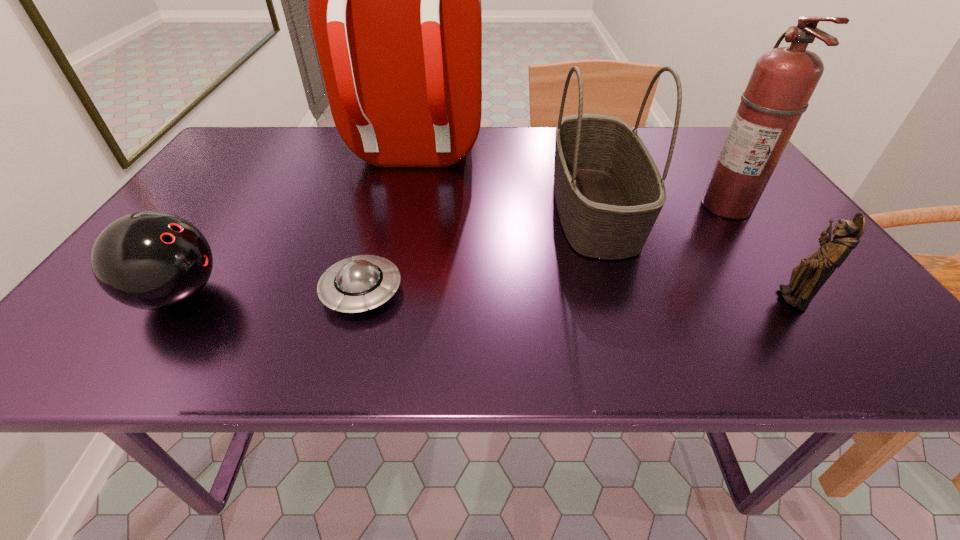
Locate an element on the screen. object that is the fourth closest to the tallest object is located at coordinates (783, 80).

The image size is (960, 540). What are the coordinates of `vacant region that satisfies the following two spatial constraints: 1. on the front side of the shortest object; 2. on the surface of the bowling ball near the finger holes` in the screenshot? It's located at (361, 295).